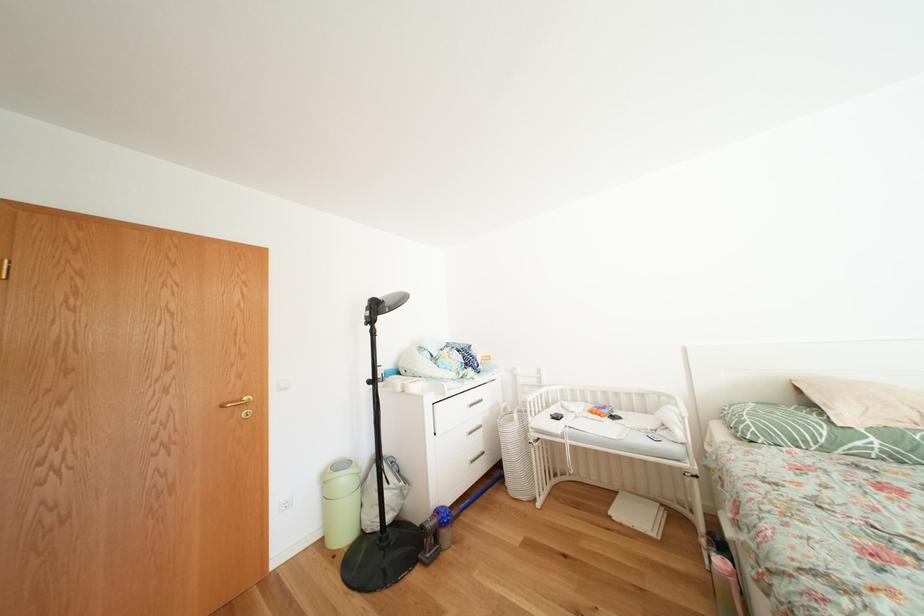
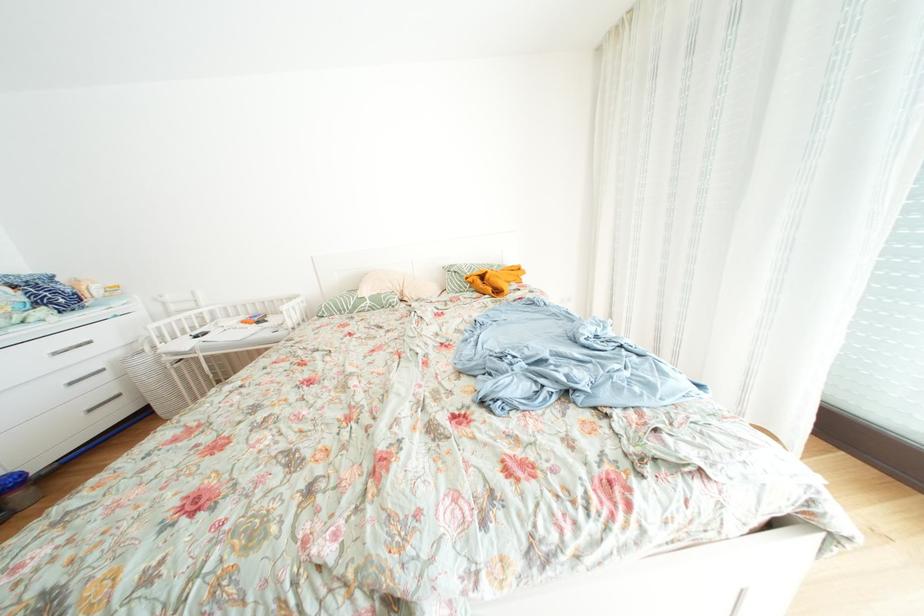
In the second image, find the point that corresponds to point (883, 445) in the first image.

(378, 307)